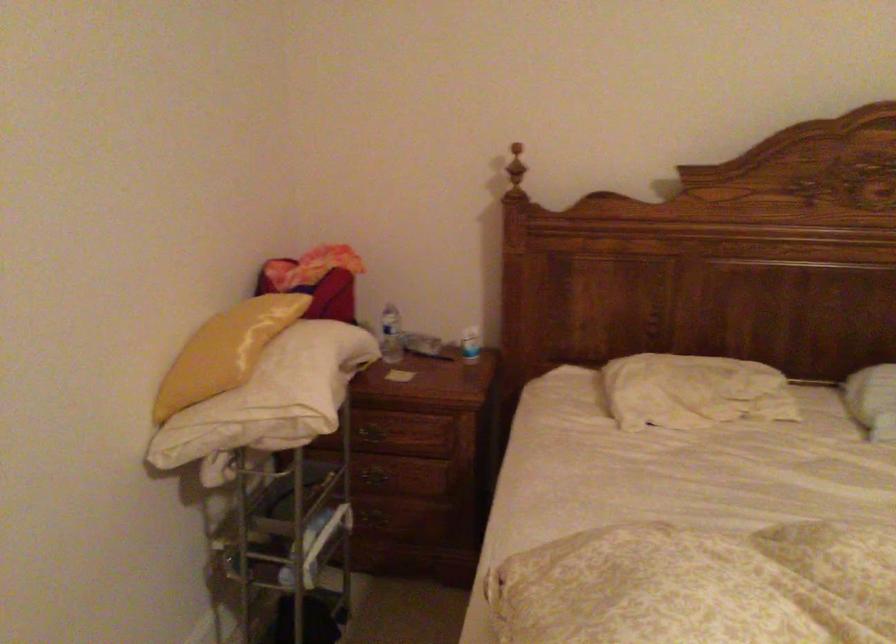
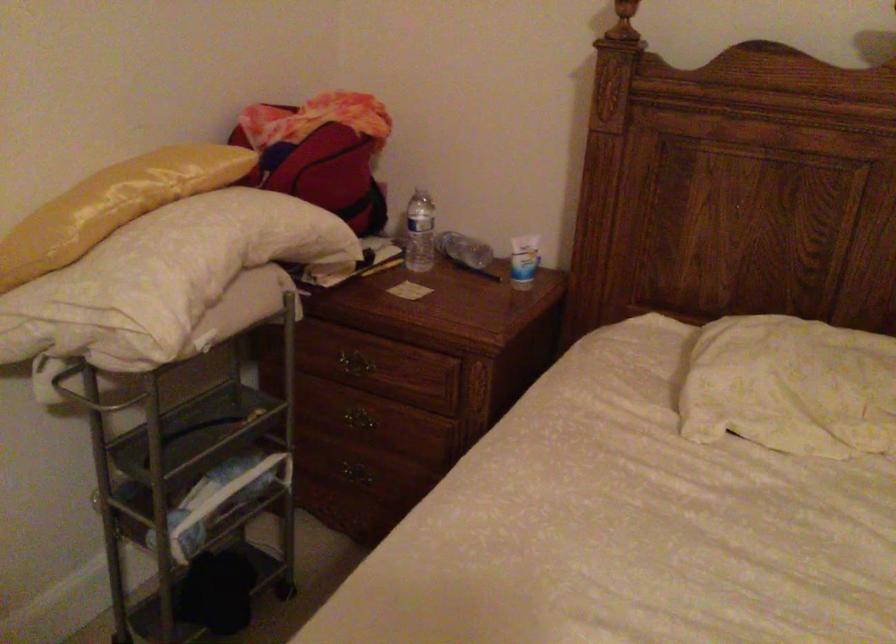
The point at (476, 343) is marked in the first image. Where is the corresponding point in the second image?

(523, 261)